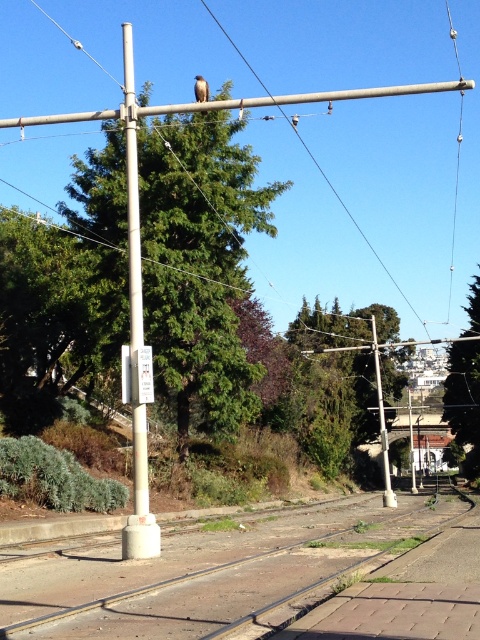
You are a maintenance worker checking the smooth metallic pole at center and the smooth concrete train track at center. Which object is located above the other?

The smooth metallic pole at center is above the smooth concrete train track at center because the train track is positioned under the pole.

You are standing at the center of the image and want to locate the smooth metallic pole at center. According to the coordinates provided, in which direction should you look to find it?

The smooth metallic pole at center is located at coordinates point (135, 333), which means it is slightly to the right and above the center point of the image.

You are a photographer standing in the middle of the sidewalk. You want to take a picture of the brown feathered eagle at upper center while avoiding the smooth metallic pole at center in the frame. Is the pole to the left or right of the eagle?

The smooth metallic pole at center is positioned on the left side of brown feathered eagle at upper center, so the pole is to the left of the eagle. To avoid it in the frame, you should adjust your position to the right side of the sidewalk.